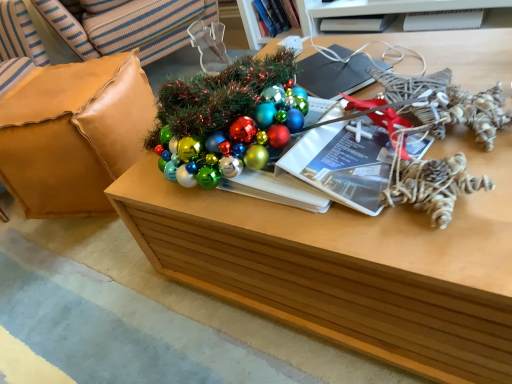
Where is `vacant space that is to the left of twisted rope ornament at right`? The height and width of the screenshot is (384, 512). vacant space that is to the left of twisted rope ornament at right is located at coordinates (341, 224).